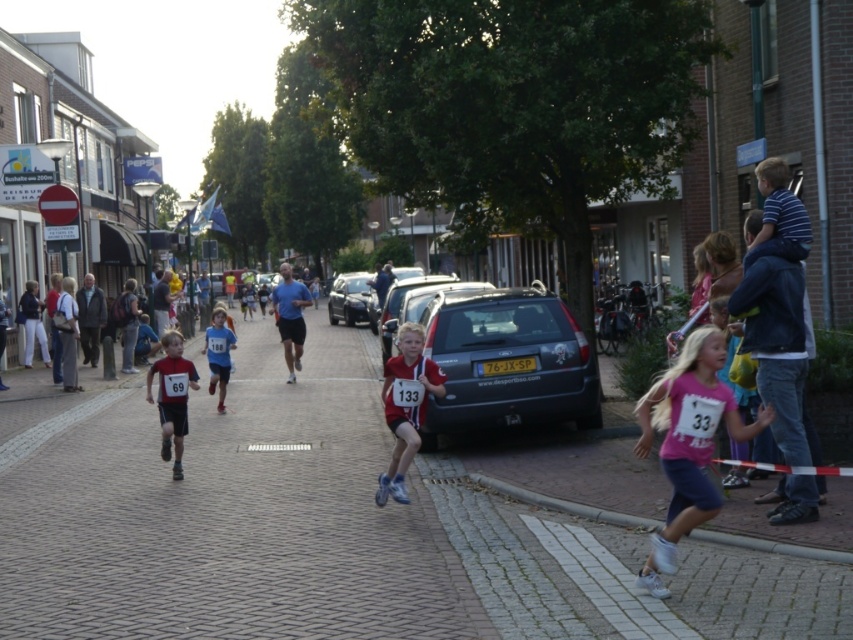
You are a photographer at the community event. You want to capture a photo that includes both the pink fabric shirt at center and the blue jersey at center. Based on their positions, which one should you focus on first to ensure both are in frame?

The pink fabric shirt at center is below the blue jersey at center, so you should focus on the blue jersey at center first to ensure both are in frame.

You are a photographer standing on the street and want to take a photo of the matte black shorts at left and the blue jersey at center. Which object should you focus on first if you want to capture both in the same frame without moving the camera?

You should focus on the blue jersey at center first because the matte black shorts at left is located below it, so adjusting the camera angle to include both would require framing from the center downward.

You are a photographer standing at the starting line of the race. You want to take a photo that includes both the point at (402, 371) and the point at (213, 355). Which point should you focus on first to ensure both are in sharp focus?

You should focus on the point at (213, 355) first because it is farther from the camera compared to the point at (402, 371). By focusing on the farther point, the closer point will also be within the depth of field, ensuring both are in sharp focus.